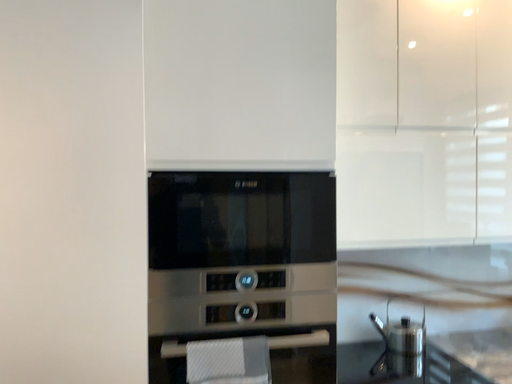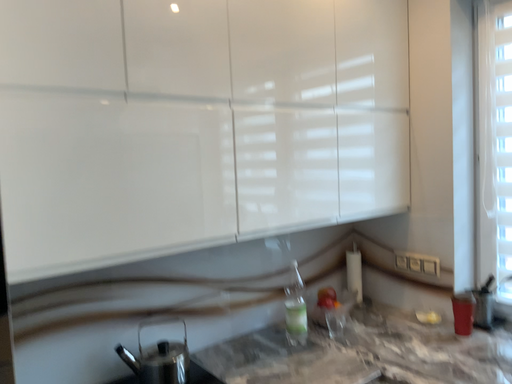
Question: Which way did the camera rotate in the video?

Choices:
 (A) rotated right
 (B) rotated left

Answer: (A)